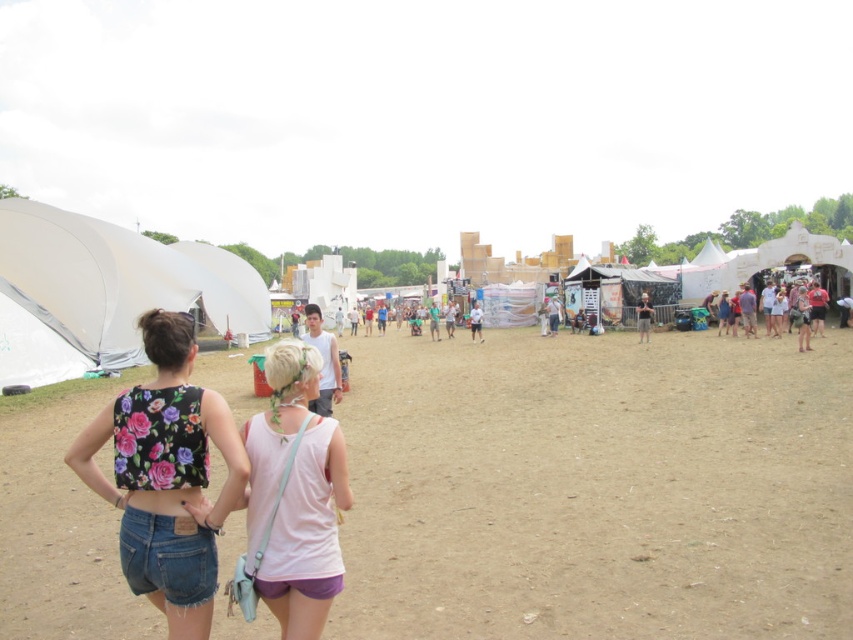
You are at the festival and want to move from the white matte tent at left to the pink fabric tank top at center. Which direction should you move in?

You should move to the right to go from the white matte tent at left to the pink fabric tank top at center because the white matte tent at left is to the left of the pink fabric tank top at center.